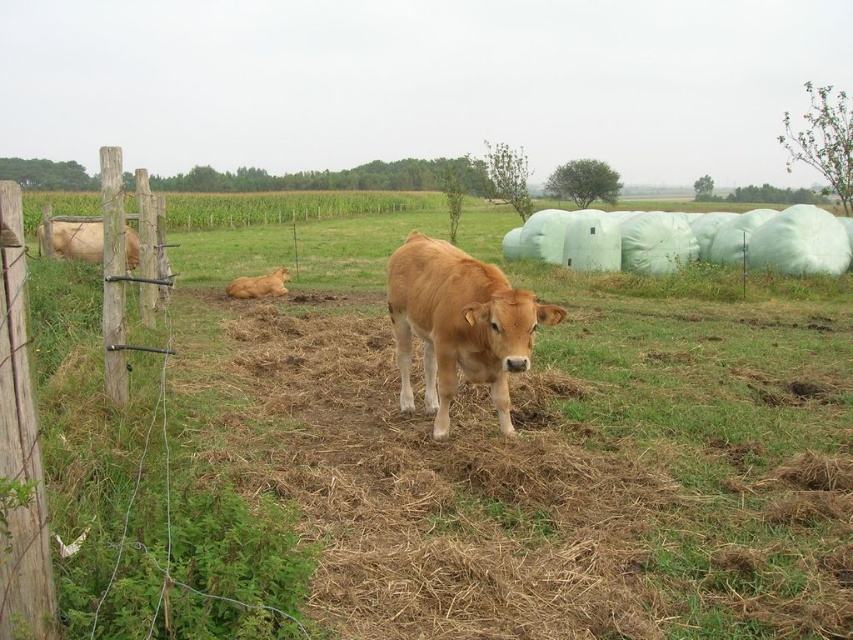
Question: Estimate the real-world distances between objects in this image. Which object is farther from the golden smooth calf at center?

Choices:
 (A) brown wooden post at left
 (B) light brown cow at left

Answer: (B)

Question: Can you confirm if brown wooden post at left is positioned to the left of light brown cow at left?

Choices:
 (A) no
 (B) yes

Answer: (A)

Question: In this image, where is brown grass at center located relative to brown furry calf at lower left?

Choices:
 (A) below
 (B) above

Answer: (B)

Question: Which of these objects is positioned closest to the brown furry calf at lower left?

Choices:
 (A) light brown cow at left
 (B) golden smooth calf at center
 (C) brown grass at center
 (D) brown wooden post at left

Answer: (A)

Question: Does brown grass at center appear under light brown cow at left?

Choices:
 (A) yes
 (B) no

Answer: (A)

Question: Which object is the farthest from the light brown cow at left?

Choices:
 (A) brown grass at center
 (B) brown wooden post at left
 (C) golden smooth calf at center
 (D) brown furry calf at lower left

Answer: (B)